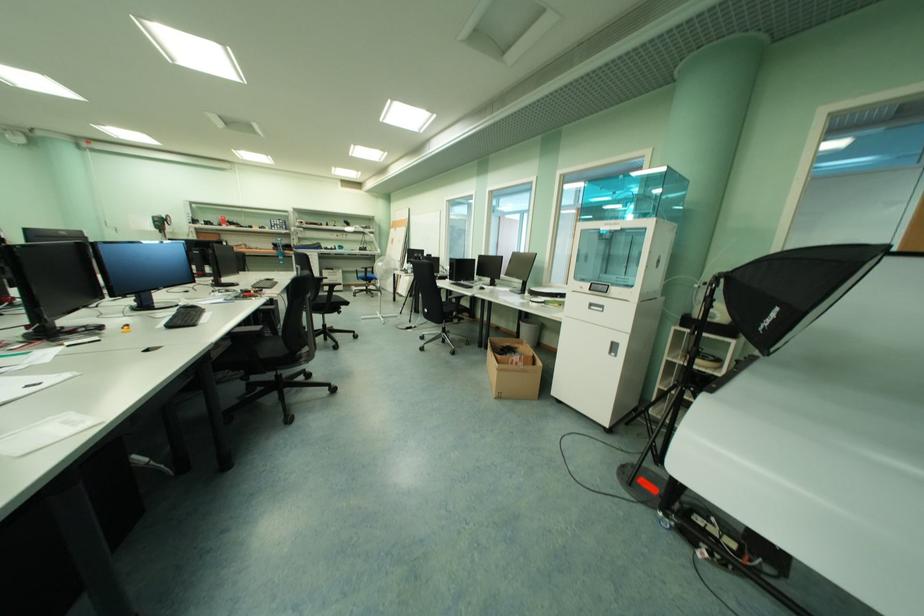
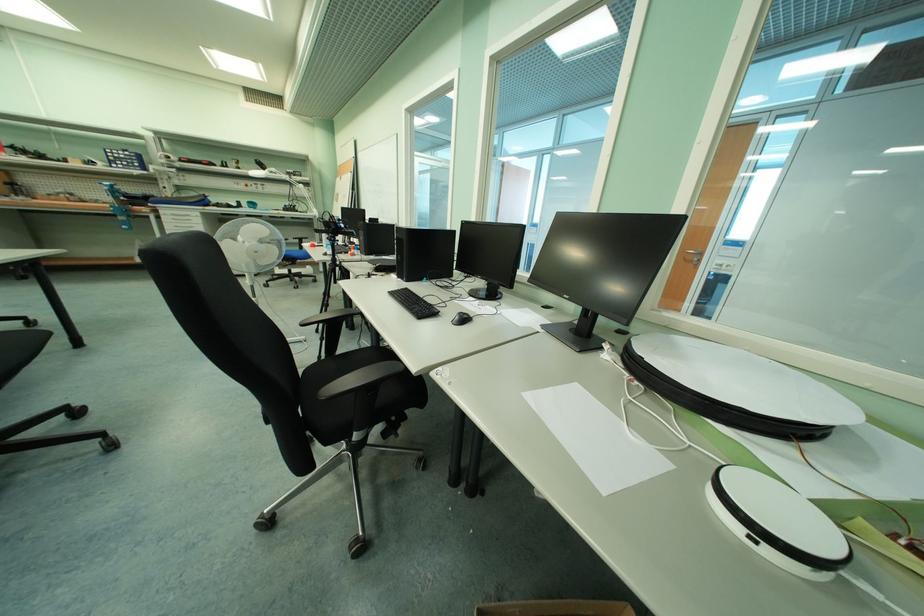
Question: What movement of the cameraman would produce the second image?

Choices:
 (A) Left
 (B) Right
 (C) Forward
 (D) Backward

Answer: (C)